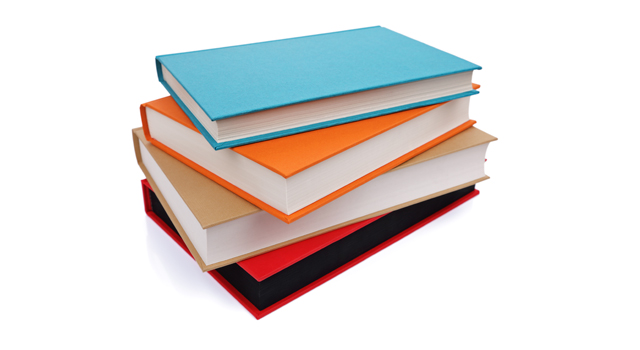
The width and height of the screenshot is (640, 350). In order to click on stacked hardcover books in this screenshot , I will do `click(284, 106)`, `click(321, 171)`, `click(403, 183)`, `click(340, 246)`.